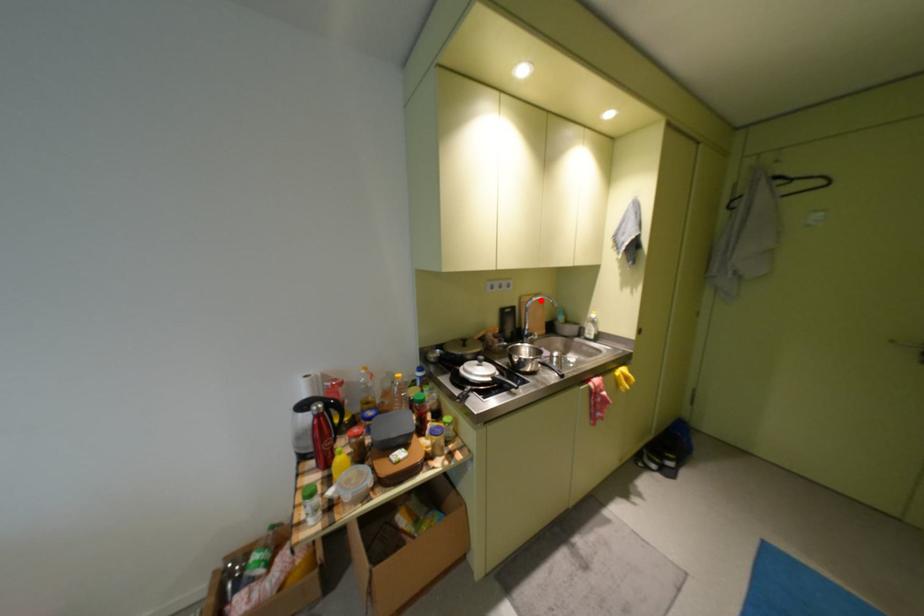
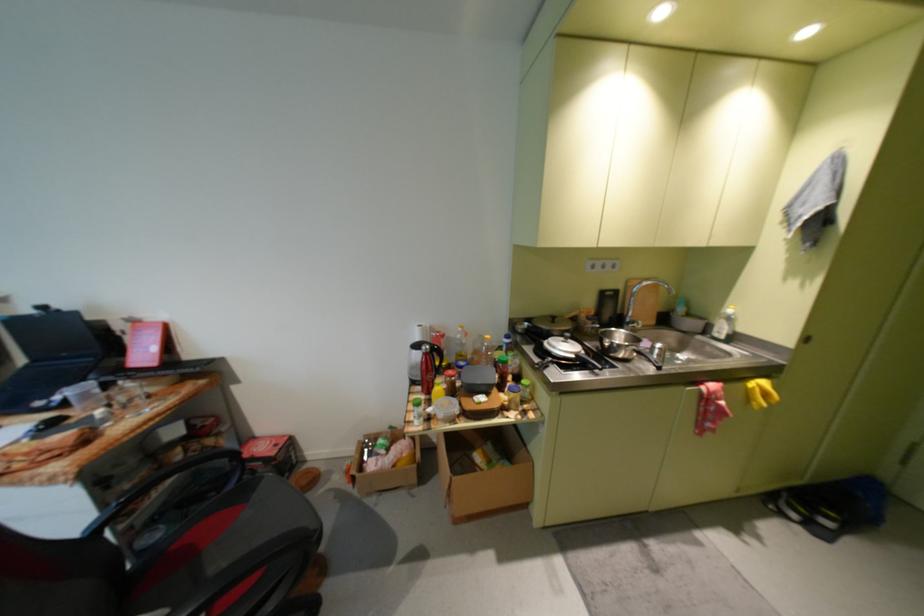
Locate, in the second image, the point that corresponds to the highlighted location in the first image.

(650, 285)